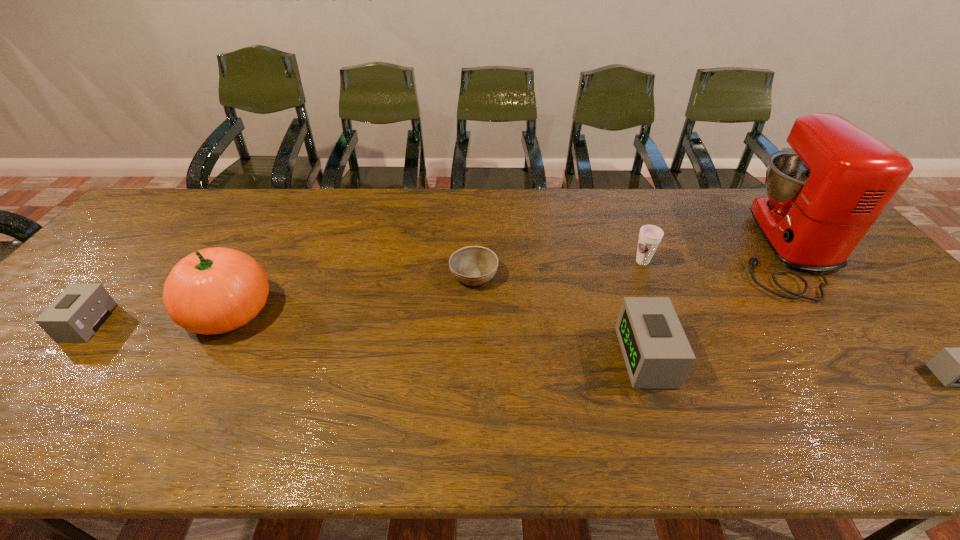
At what (x,y) coordinates should I click in order to perform the action: click on free space located on the front-facing side of the tallest alarm clock. Please return your answer as a coordinate pair (x, y). The image size is (960, 540). Looking at the image, I should click on (512, 356).

At what (x,y) coordinates should I click in order to perform the action: click on free space located 0.400m on the front-facing side of the tallest alarm clock. Please return your answer as a coordinate pair (x, y). The width and height of the screenshot is (960, 540). Looking at the image, I should click on (451, 356).

Find the location of a particular element. The width and height of the screenshot is (960, 540). vacant space situated 0.060m on the front-facing side of the tallest alarm clock is located at coordinates tap(597, 356).

You are a GUI agent. You are given a task and a screenshot of the screen. Output one action in this format:
    pyautogui.click(x=<x>, y=<y>)
    Task: Click on the vacant space situated on the front-facing side of the tallest object
    The width and height of the screenshot is (960, 540).
    Given the screenshot: What is the action you would take?
    pyautogui.click(x=665, y=248)

In order to click on vacant region located 0.250m on the front-facing side of the tallest object in this screenshot , I will do `click(646, 248)`.

This screenshot has width=960, height=540. Find the location of `free space located 0.070m on the front-facing side of the tallest object`. free space located 0.070m on the front-facing side of the tallest object is located at coordinates (706, 248).

I want to click on free region located on the right of the sixth object from right to left, so click(348, 312).

At what (x,y) coordinates should I click in order to perform the action: click on vacant space located on the back of the cup. Please return your answer as a coordinate pair (x, y). Looking at the image, I should click on (612, 189).

Locate an element on the screen. The height and width of the screenshot is (540, 960). vacant space located 0.290m on the front of the bowl is located at coordinates (472, 386).

This screenshot has width=960, height=540. Find the location of `object that is positioned at the far edge`. object that is positioned at the far edge is located at coordinates (823, 195).